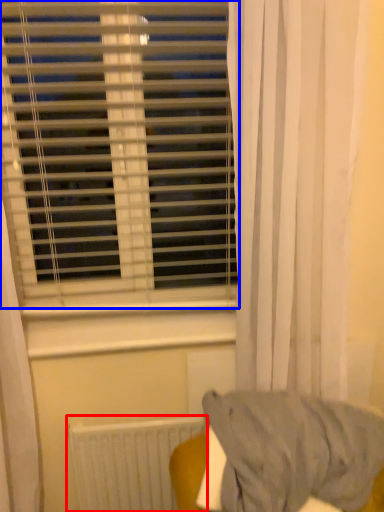
Question: Which object is closer to the camera taking this photo, radiator (highlighted by a red box) or window blind (highlighted by a blue box)?

Choices:
 (A) radiator
 (B) window blind

Answer: (B)